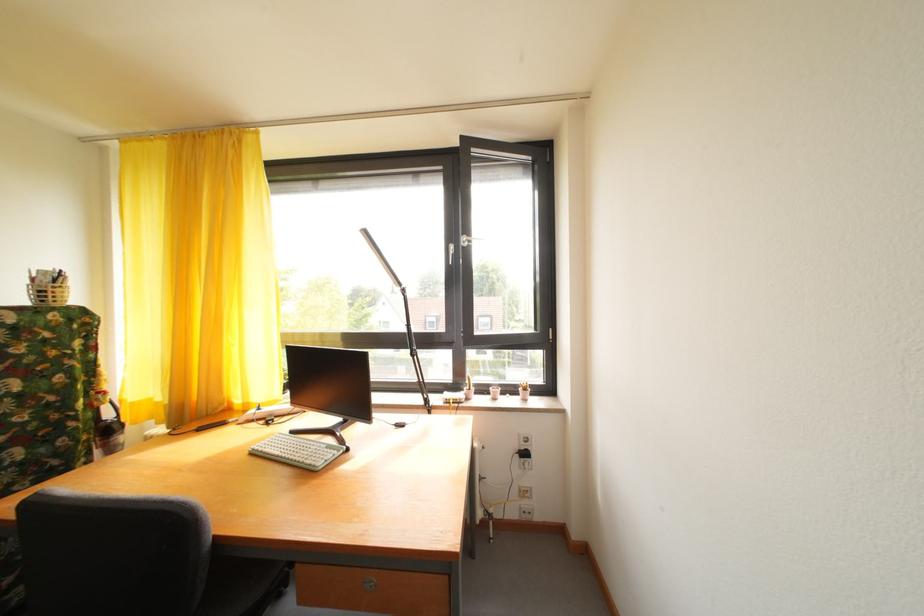
At what (x,y) coordinates should I click in order to perform the action: click on drawer lock. Please return your answer as a coordinate pair (x, y). The width and height of the screenshot is (924, 616). Looking at the image, I should click on click(369, 584).